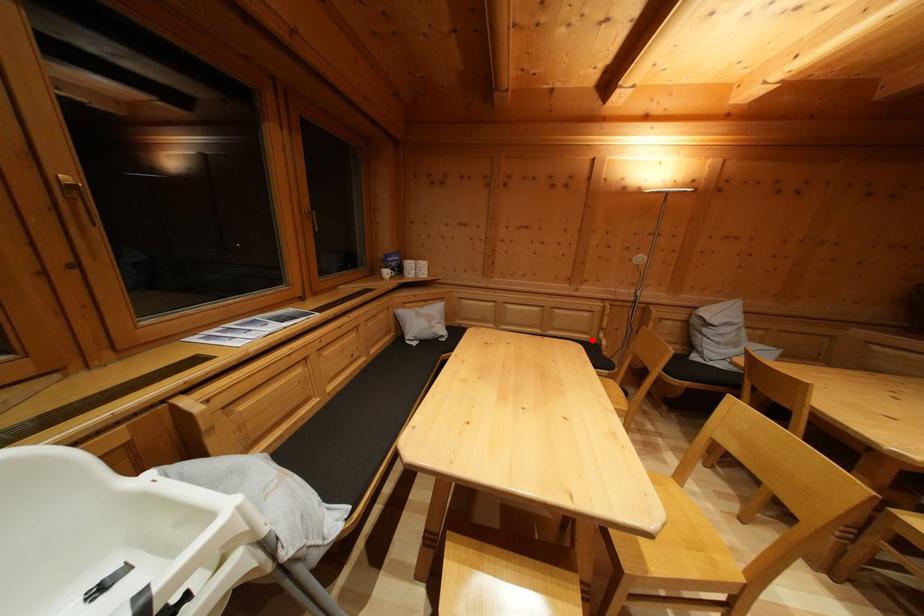
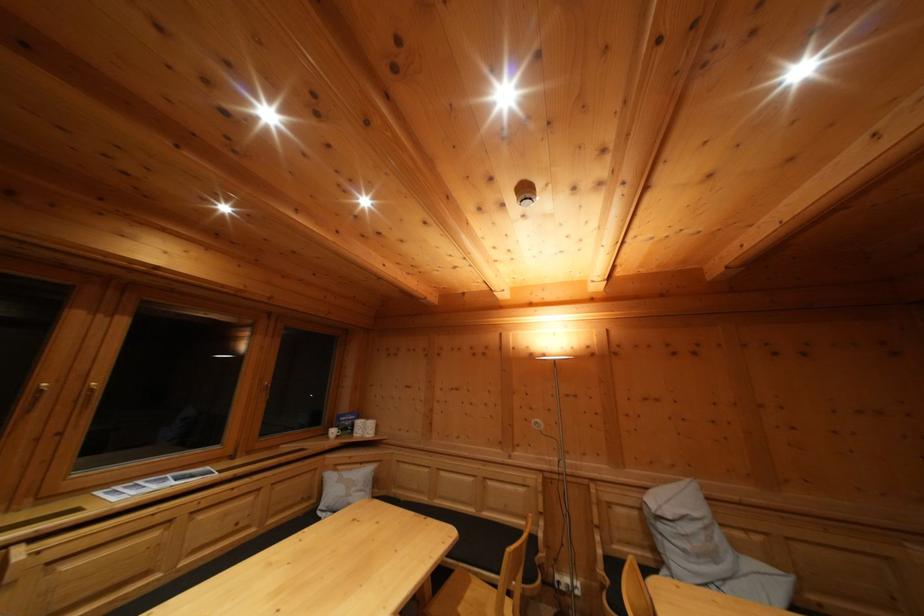
Where in the second image is the point corresponding to the highlighted location from the first image?

(532, 525)